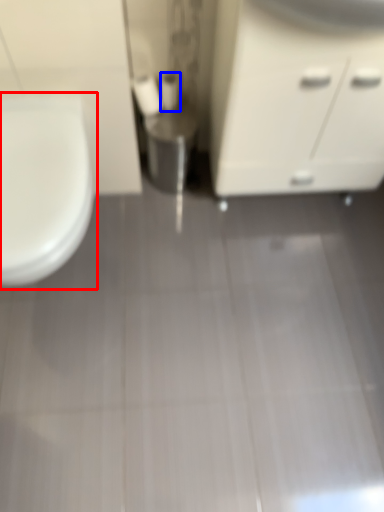
Question: Among these objects, which one is farthest to the camera, toilet (highlighted by a red box) or toilet paper (highlighted by a blue box)?

Choices:
 (A) toilet
 (B) toilet paper

Answer: (B)